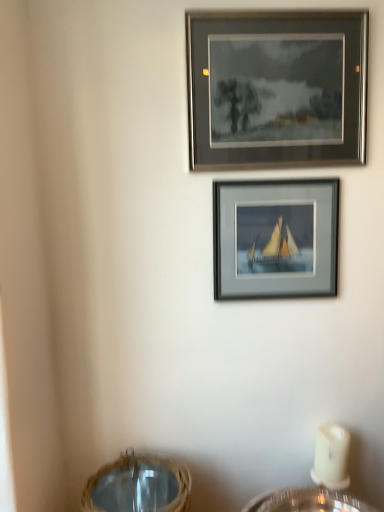
Question: Are matte gray frame at center, the first picture frame when ordered from bottom to top, and woven straw basket at lower center beside each other?

Choices:
 (A) yes
 (B) no

Answer: (B)

Question: Is matte gray frame at center, the first picture frame when ordered from bottom to top, at the right side of woven straw basket at lower center?

Choices:
 (A) no
 (B) yes

Answer: (B)

Question: Is matte gray frame at center, the second picture frame when ordered from top to bottom, further to the viewer compared to woven straw basket at lower center?

Choices:
 (A) yes
 (B) no

Answer: (A)

Question: Is the position of matte gray frame at center, the second picture frame when ordered from top to bottom, less distant than that of woven straw basket at lower center?

Choices:
 (A) yes
 (B) no

Answer: (B)

Question: Does matte gray frame at center, the second picture frame when ordered from top to bottom, contain woven straw basket at lower center?

Choices:
 (A) yes
 (B) no

Answer: (B)

Question: Do you think woven straw basket at lower center is within matte gray frame at upper center, which is the 2th picture frame in bottom-to-top order, or outside of it?

Choices:
 (A) inside
 (B) outside

Answer: (B)

Question: Considering the positions of woven straw basket at lower center and matte gray frame at upper center, which is the 2th picture frame in bottom-to-top order, in the image, is woven straw basket at lower center bigger or smaller than matte gray frame at upper center, which is the 2th picture frame in bottom-to-top order,?

Choices:
 (A) small
 (B) big

Answer: (B)

Question: Is woven straw basket at lower center to the left or to the right of matte gray frame at upper center, marked as the 1th picture frame in a top-to-bottom arrangement, in the image?

Choices:
 (A) left
 (B) right

Answer: (A)

Question: Looking at their shapes, would you say woven straw basket at lower center is wider or thinner than matte gray frame at upper center, which is the 2th picture frame in bottom-to-top order?

Choices:
 (A) thin
 (B) wide

Answer: (B)

Question: From their relative heights in the image, would you say matte gray frame at upper center, which is the 2th picture frame in bottom-to-top order, is taller or shorter than matte gray frame at center, the second picture frame when ordered from top to bottom?

Choices:
 (A) tall
 (B) short

Answer: (A)

Question: From the image's perspective, relative to matte gray frame at center, the first picture frame when ordered from bottom to top, is matte gray frame at upper center, which is the 2th picture frame in bottom-to-top order, above or below?

Choices:
 (A) above
 (B) below

Answer: (A)

Question: Is matte gray frame at upper center, which is the 2th picture frame in bottom-to-top order, spatially inside matte gray frame at center, the second picture frame when ordered from top to bottom, or outside of it?

Choices:
 (A) inside
 (B) outside

Answer: (B)

Question: Looking at their shapes, would you say matte gray frame at upper center, marked as the 1th picture frame in a top-to-bottom arrangement, is wider or thinner than matte gray frame at center, the second picture frame when ordered from top to bottom?

Choices:
 (A) wide
 (B) thin

Answer: (A)

Question: Do you think woven straw basket at lower center is within matte gray frame at center, the second picture frame when ordered from top to bottom, or outside of it?

Choices:
 (A) inside
 (B) outside

Answer: (B)

Question: Is woven straw basket at lower center to the left or to the right of matte gray frame at center, the first picture frame when ordered from bottom to top, in the image?

Choices:
 (A) left
 (B) right

Answer: (A)